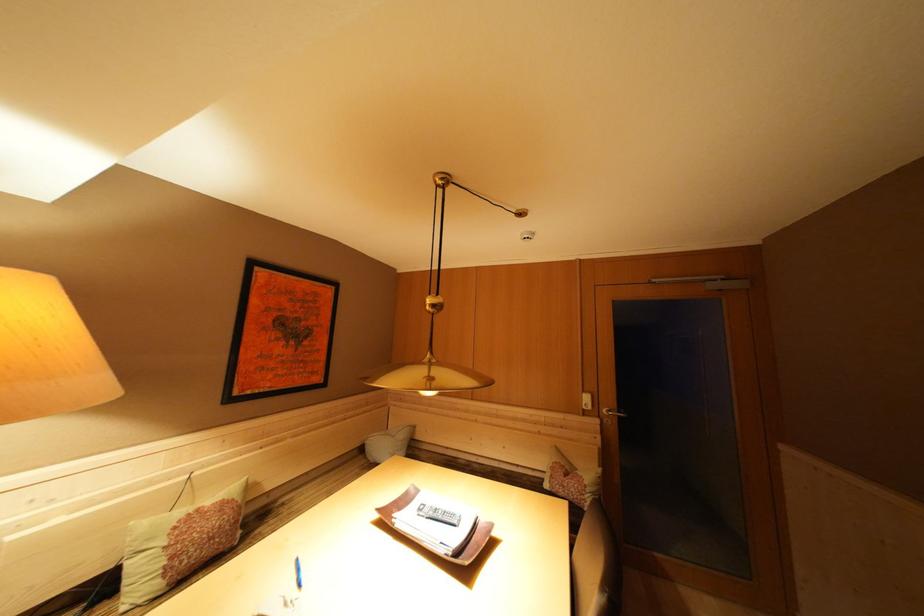
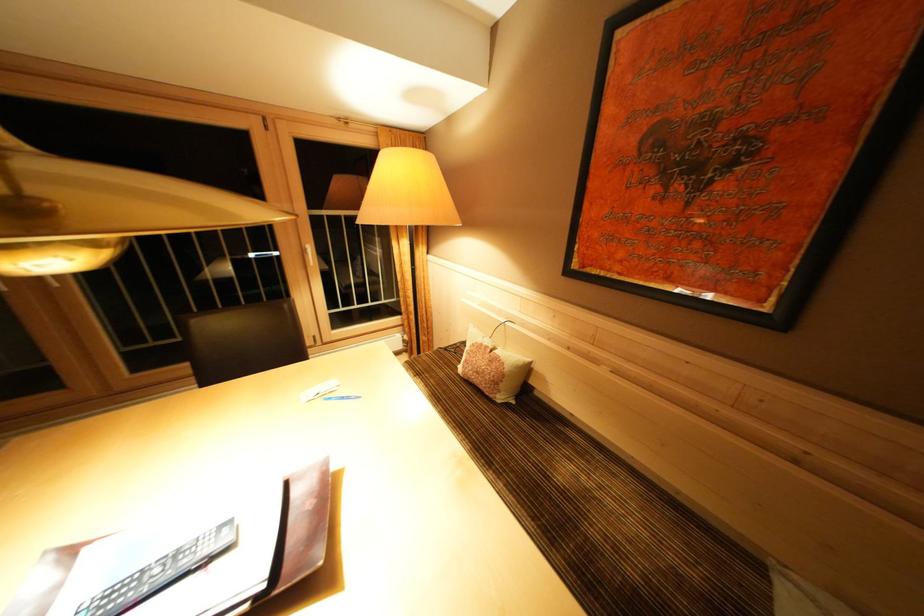
In the second image, find the point that corresponds to (x=204, y=515) in the first image.

(493, 352)